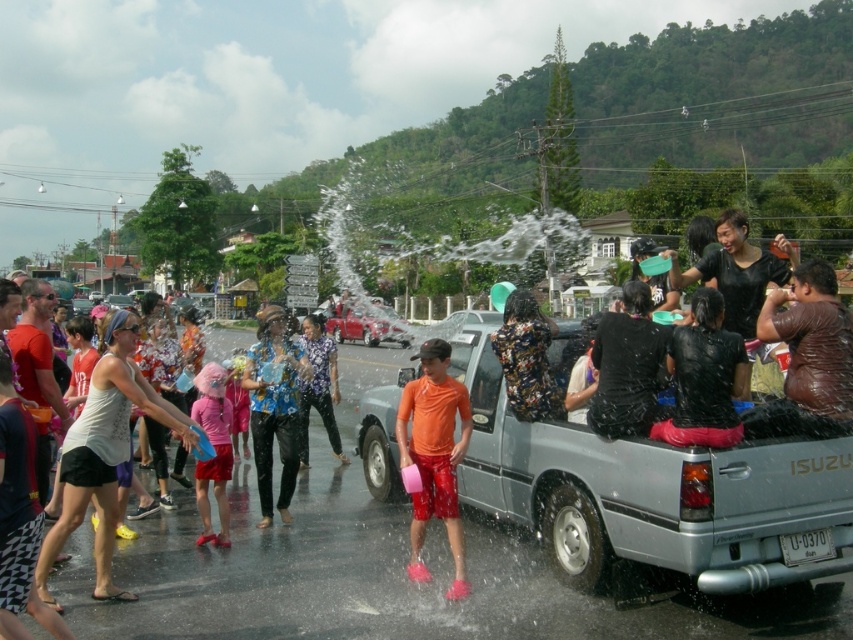
What do you see at coordinates (650, 490) in the screenshot?
I see `silver metallic truck at center` at bounding box center [650, 490].

Is silver metallic truck at center wider than orange matte shirt at center?

No, silver metallic truck at center is not wider than orange matte shirt at center.

Between point (575, 442) and point (407, 401), which one is positioned in front?

Point (575, 442)

The image size is (853, 640). Find the location of `silver metallic truck at center`. silver metallic truck at center is located at coordinates (650, 490).

Between point (112, 401) and point (254, 360), which one is positioned in front?

Point (112, 401) is more forward.

Which is in front, point (115, 449) or point (277, 410)?

Positioned in front is point (115, 449).

You are a GUI agent. You are given a task and a screenshot of the screen. Output one action in this format:
    pyautogui.click(x=<x>, y=<y>)
    Task: Click on the white cotton tank top at center
    This screenshot has height=640, width=853.
    Given the screenshot: What is the action you would take?
    pyautogui.click(x=106, y=454)

Which is above, orange matte shirt at center or floral fabric shirt at center?

Positioned higher is floral fabric shirt at center.

Locate an element on the screen. The image size is (853, 640). orange matte shirt at center is located at coordinates (434, 456).